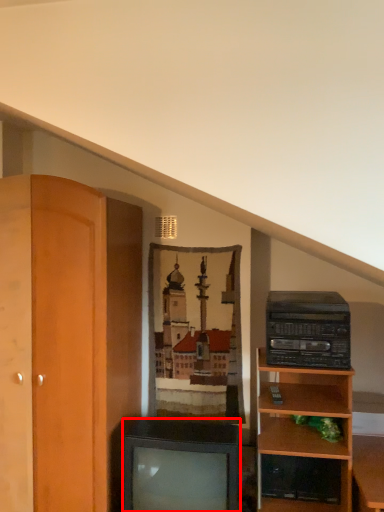
Question: From the image's perspective, considering the relative positions of television (annotated by the red box) and stereo in the image provided, where is television (annotated by the red box) located with respect to the staircase?

Choices:
 (A) below
 (B) above

Answer: (A)